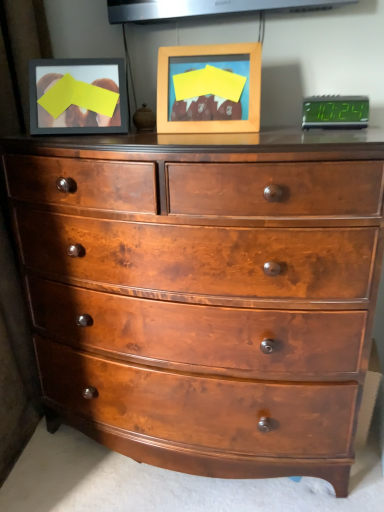
Question: Is green digital display at upper right taller than wooden picture frame at center?

Choices:
 (A) no
 (B) yes

Answer: (A)

Question: Is wooden picture frame at center located within green digital display at upper right?

Choices:
 (A) yes
 (B) no

Answer: (B)

Question: Considering the relative sizes of green digital display at upper right and wooden picture frame at center in the image provided, is green digital display at upper right thinner than wooden picture frame at center?

Choices:
 (A) no
 (B) yes

Answer: (B)

Question: Could you tell me if green digital display at upper right is facing wooden picture frame at center?

Choices:
 (A) yes
 (B) no

Answer: (B)

Question: Is green digital display at upper right touching wooden picture frame at center?

Choices:
 (A) yes
 (B) no

Answer: (B)

Question: Can you confirm if green digital display at upper right is shorter than wooden picture frame at center?

Choices:
 (A) no
 (B) yes

Answer: (B)

Question: Is wooden picture frame at center facing towards shiny brown wood chest of drawers at center?

Choices:
 (A) yes
 (B) no

Answer: (B)

Question: Is the depth of wooden picture frame at center greater than that of shiny brown wood chest of drawers at center?

Choices:
 (A) yes
 (B) no

Answer: (A)

Question: Can you confirm if wooden picture frame at center is shorter than shiny brown wood chest of drawers at center?

Choices:
 (A) yes
 (B) no

Answer: (A)

Question: Can you confirm if wooden picture frame at center is wider than shiny brown wood chest of drawers at center?

Choices:
 (A) yes
 (B) no

Answer: (B)

Question: Considering the relative sizes of wooden picture frame at center and shiny brown wood chest of drawers at center in the image provided, is wooden picture frame at center thinner than shiny brown wood chest of drawers at center?

Choices:
 (A) yes
 (B) no

Answer: (A)

Question: Considering the relative sizes of wooden picture frame at center and shiny brown wood chest of drawers at center in the image provided, is wooden picture frame at center smaller than shiny brown wood chest of drawers at center?

Choices:
 (A) no
 (B) yes

Answer: (B)

Question: Is wooden picture frame at center wider than green digital display at upper right?

Choices:
 (A) no
 (B) yes

Answer: (B)